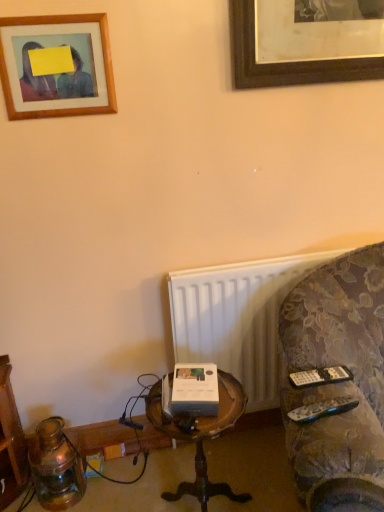
Question: Is the depth of velvet-patterned couch at right greater than that of black plastic remote at right, which is the 2th remote from front to back?

Choices:
 (A) no
 (B) yes

Answer: (A)

Question: Does velvet-patterned couch at right have a greater width compared to black plastic remote at right, the 1th remote in the back-to-front sequence?

Choices:
 (A) no
 (B) yes

Answer: (B)

Question: Are velvet-patterned couch at right and black plastic remote at right, which is the 2th remote from front to back, making contact?

Choices:
 (A) yes
 (B) no

Answer: (B)

Question: Is velvet-patterned couch at right at the right side of black plastic remote at right, the 1th remote in the back-to-front sequence?

Choices:
 (A) yes
 (B) no

Answer: (A)

Question: From the image's perspective, is velvet-patterned couch at right beneath black plastic remote at right, which is the 2th remote from front to back?

Choices:
 (A) yes
 (B) no

Answer: (A)

Question: Would you say velvet-patterned couch at right is to the left or to the right of white plastic radiator at lower right in the picture?

Choices:
 (A) left
 (B) right

Answer: (B)

Question: From a real-world perspective, is velvet-patterned couch at right physically located above or below white plastic radiator at lower right?

Choices:
 (A) above
 (B) below

Answer: (A)

Question: From the image's perspective, is velvet-patterned couch at right positioned above or below white plastic radiator at lower right?

Choices:
 (A) above
 (B) below

Answer: (B)

Question: In terms of height, does velvet-patterned couch at right look taller or shorter compared to white plastic radiator at lower right?

Choices:
 (A) tall
 (B) short

Answer: (A)

Question: From a real-world perspective, is black plastic remote at lower right, which appears as the first remote when viewed from the front, positioned above or below woodenobject at center?

Choices:
 (A) above
 (B) below

Answer: (A)

Question: Considering the positions of black plastic remote at lower right, the second remote positioned from the back, and woodenobject at center in the image, is black plastic remote at lower right, the second remote positioned from the back, bigger or smaller than woodenobject at center?

Choices:
 (A) big
 (B) small

Answer: (B)

Question: From the image's perspective, is black plastic remote at lower right, the second remote positioned from the back, located above or below woodenobject at center?

Choices:
 (A) above
 (B) below

Answer: (A)

Question: Is black plastic remote at lower right, the second remote positioned from the back, wider or thinner than woodenobject at center?

Choices:
 (A) thin
 (B) wide

Answer: (A)

Question: From the image's perspective, is black plastic remote at right, which is the 2th remote from front to back, located above or below white plastic radiator at lower right?

Choices:
 (A) below
 (B) above

Answer: (B)

Question: Is black plastic remote at right, which is the 2th remote from front to back, inside the boundaries of white plastic radiator at lower right, or outside?

Choices:
 (A) inside
 (B) outside

Answer: (B)